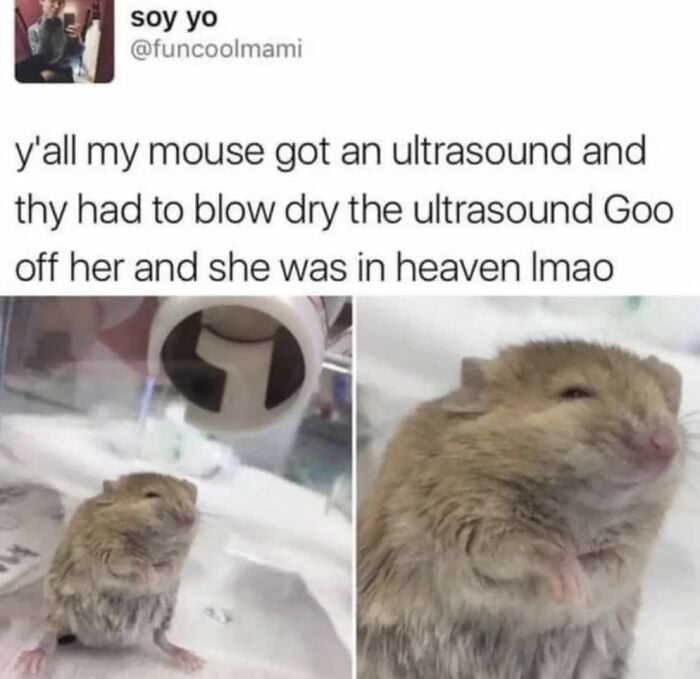
You are a GUI agent. You are given a task and a screenshot of the screen. Output one action in this format:
    pyautogui.click(x=<x>, y=<y>)
    Task: Click on the glass wall
    
    Given the screenshot: What is the action you would take?
    pyautogui.click(x=78, y=350)